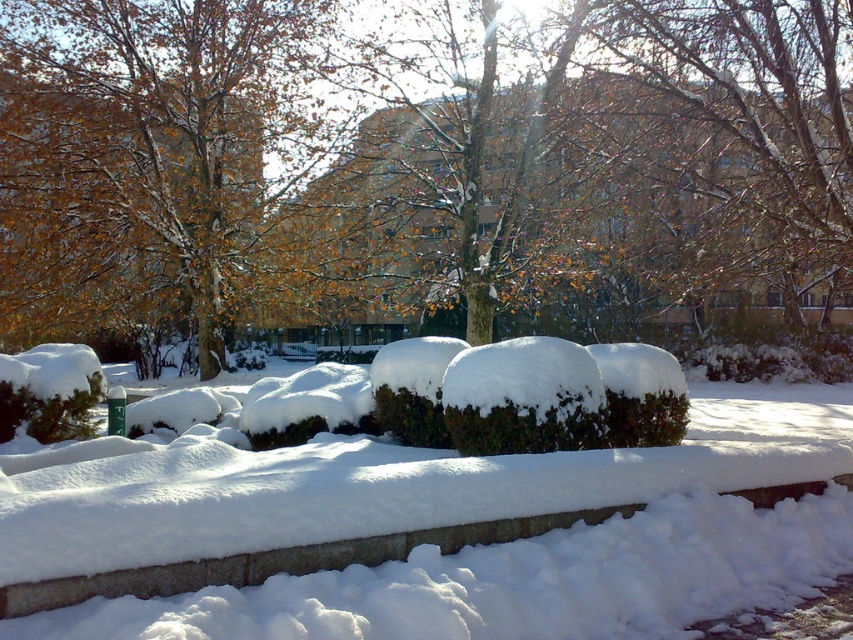
Question: From the image, what is the correct spatial relationship of white fluffy snow at center in relation to brown textured tree at upper center?

Choices:
 (A) below
 (B) above

Answer: (A)

Question: Can you confirm if white fluffy snow at center is positioned to the left of brown textured tree at upper center?

Choices:
 (A) no
 (B) yes

Answer: (A)

Question: Which of the following is the farthest from the observer?

Choices:
 (A) white fluffy snow at center
 (B) brown textured tree at upper center

Answer: (B)

Question: Can you confirm if white fluffy snow at center is thinner than brown textured tree at upper center?

Choices:
 (A) yes
 (B) no

Answer: (A)